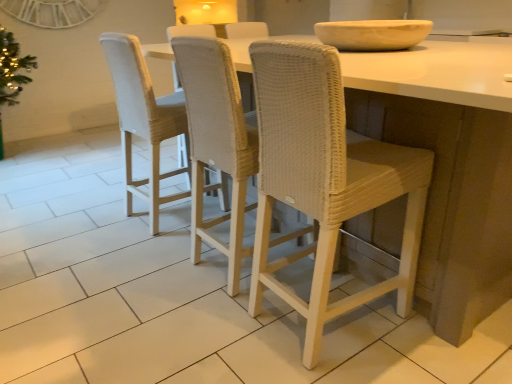
Question: Which direction should I rotate to look at woven beige chair at center, marked as the second chair in a right-to-left arrangement, — up or down?

Choices:
 (A) up
 (B) down

Answer: (A)

Question: Is woven beige chair at center, placed as the first chair when sorted from left to right, closer to camera compared to white woven stool at center?

Choices:
 (A) no
 (B) yes

Answer: (A)

Question: From a real-world perspective, is woven beige chair at center, placed as the first chair when sorted from left to right, positioned under white woven stool at center based on gravity?

Choices:
 (A) yes
 (B) no

Answer: (B)

Question: From a real-world perspective, is woven beige chair at center, placed as the first chair when sorted from left to right, on top of white woven stool at center?

Choices:
 (A) no
 (B) yes

Answer: (B)

Question: Is woven beige chair at center, the 3th chair viewed from the right, behind white woven stool at center?

Choices:
 (A) no
 (B) yes

Answer: (B)

Question: Is woven beige chair at center, the 3th chair viewed from the right, positioned with its back to white woven stool at center?

Choices:
 (A) yes
 (B) no

Answer: (A)

Question: Are woven beige chair at center, placed as the first chair when sorted from left to right, and white woven stool at center beside each other?

Choices:
 (A) no
 (B) yes

Answer: (A)

Question: Is beige stone bowl at upper center taller than white wicker chair at center, the third chair in the left-to-right sequence?

Choices:
 (A) no
 (B) yes

Answer: (A)

Question: Can white wicker chair at center, which ranks as the 1th chair in right-to-left order, be found inside beige stone bowl at upper center?

Choices:
 (A) yes
 (B) no

Answer: (B)

Question: Can you confirm if beige stone bowl at upper center is shorter than white wicker chair at center, which ranks as the 1th chair in right-to-left order?

Choices:
 (A) no
 (B) yes

Answer: (B)

Question: Considering the relative sizes of beige stone bowl at upper center and white wicker chair at center, the third chair in the left-to-right sequence, in the image provided, is beige stone bowl at upper center smaller than white wicker chair at center, the third chair in the left-to-right sequence,?

Choices:
 (A) yes
 (B) no

Answer: (A)

Question: Is beige stone bowl at upper center in front of white wicker chair at center, which ranks as the 1th chair in right-to-left order?

Choices:
 (A) yes
 (B) no

Answer: (B)

Question: Is beige stone bowl at upper center facing away from white wicker chair at center, the third chair in the left-to-right sequence?

Choices:
 (A) yes
 (B) no

Answer: (B)

Question: Does beige stone bowl at upper center appear on the left side of woven beige chair at center, the 3th chair viewed from the right?

Choices:
 (A) yes
 (B) no

Answer: (B)